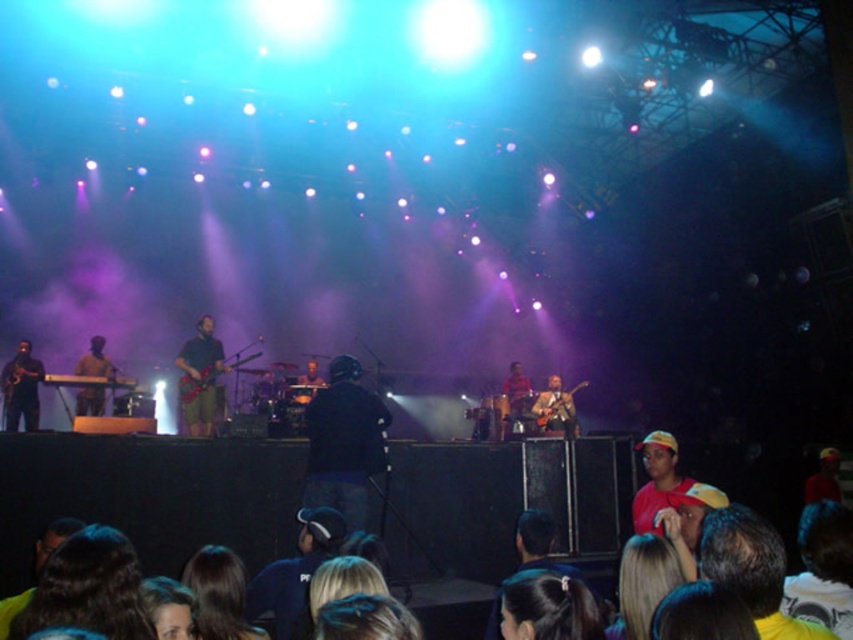
Question: Which point is closer to the camera taking this photo?

Choices:
 (A) (577, 612)
 (B) (6, 403)
 (C) (554, 428)

Answer: (A)

Question: Is wooden acoustic guitar at center further to the viewer compared to metallic guitar at center?

Choices:
 (A) yes
 (B) no

Answer: (A)

Question: Can you confirm if dark brown hair at lower center is smaller than shiny black saxophone at left?

Choices:
 (A) no
 (B) yes

Answer: (B)

Question: Which point is farther to the camera?

Choices:
 (A) metallic guitar at center
 (B) dark brown hair at lower center

Answer: (A)

Question: Which is nearer to the matte black keyboard at left?

Choices:
 (A) metallic guitar at center
 (B) shiny red guitar at center
 (C) shiny black saxophone at left

Answer: (B)

Question: Considering the relative positions of wooden acoustic guitar at center and matte black keyboard at left in the image provided, where is wooden acoustic guitar at center located with respect to matte black keyboard at left?

Choices:
 (A) left
 (B) right

Answer: (B)